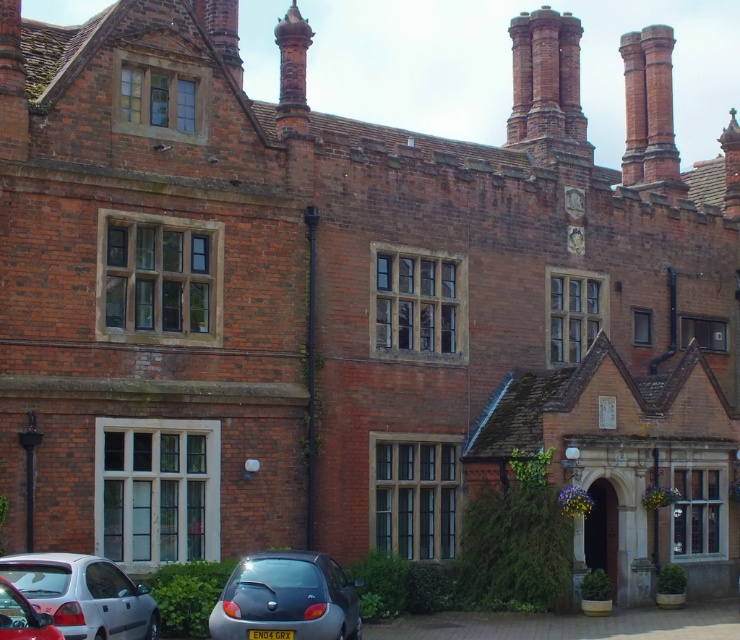
Question: Among these points, which one is farthest from the camera?

Choices:
 (A) (633, 122)
 (B) (565, 68)

Answer: (A)

Question: Does red brick chimney at upper center have a lesser width compared to metallic silver car at lower left?

Choices:
 (A) no
 (B) yes

Answer: (A)

Question: Is silver metallic hatchback at lower left below metallic silver car at lower left?

Choices:
 (A) no
 (B) yes

Answer: (B)

Question: Does silver metallic hatchback at lower left come behind red brick chimney at upper center?

Choices:
 (A) yes
 (B) no

Answer: (B)

Question: Which point is closer to the camera?

Choices:
 (A) (630, 141)
 (B) (67, 595)
 (C) (212, 620)

Answer: (B)

Question: Which of these objects is positioned farthest from the metallic silver car at lower left?

Choices:
 (A) red brick chimney at upper right
 (B) metallic gray car at lower left

Answer: (A)